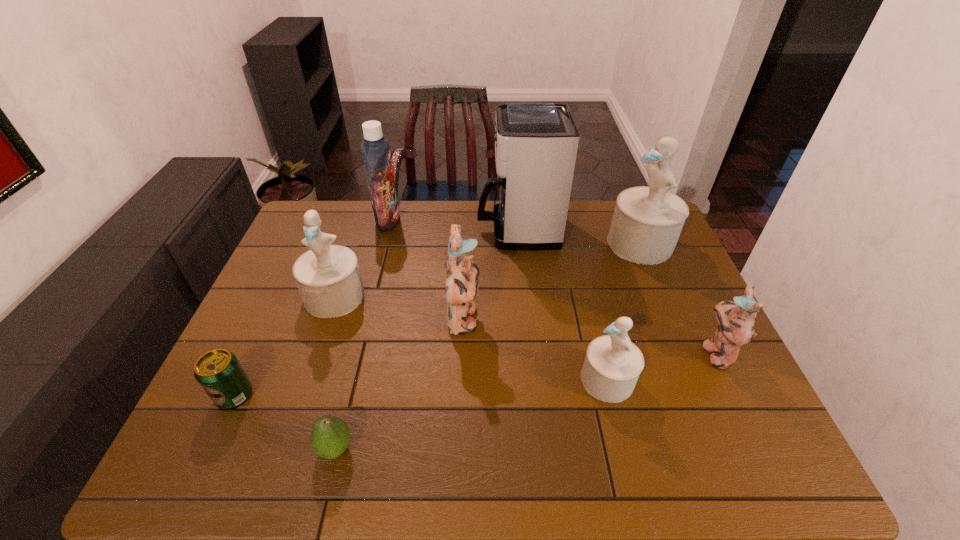
Identify the location of the smaller pink figurine. The image size is (960, 540). (736, 327).

At what (x,y) coordinates should I click in order to perform the action: click on the leftmost object. Please return your answer as a coordinate pair (x, y). This screenshot has height=540, width=960. Looking at the image, I should click on (220, 374).

Locate an element on the screen. The image size is (960, 540). beer can is located at coordinates (220, 374).

Find the location of a particular element. This screenshot has height=540, width=960. the nearest object is located at coordinates (330, 436).

Find the location of `free space located on the front panel of the coffee maker`. free space located on the front panel of the coffee maker is located at coordinates (434, 230).

You are a GUI agent. You are given a task and a screenshot of the screen. Output one action in this format:
    pyautogui.click(x=<x>, y=<y>)
    Task: Click on the vacant space located on the front panel of the coffee maker
    This screenshot has height=540, width=960.
    Given the screenshot: What is the action you would take?
    pyautogui.click(x=454, y=230)

In order to click on free space located 0.240m on the front panel of the coffee maker in this screenshot , I will do `click(407, 230)`.

Where is `vacant space located at the beak of the tallest figurine`? This screenshot has height=540, width=960. vacant space located at the beak of the tallest figurine is located at coordinates [x=520, y=244].

The height and width of the screenshot is (540, 960). Identify the location of vacant region located 0.130m at the beak of the tallest figurine. (568, 244).

The height and width of the screenshot is (540, 960). Identify the location of vacant area located at the beak of the tallest figurine. (511, 244).